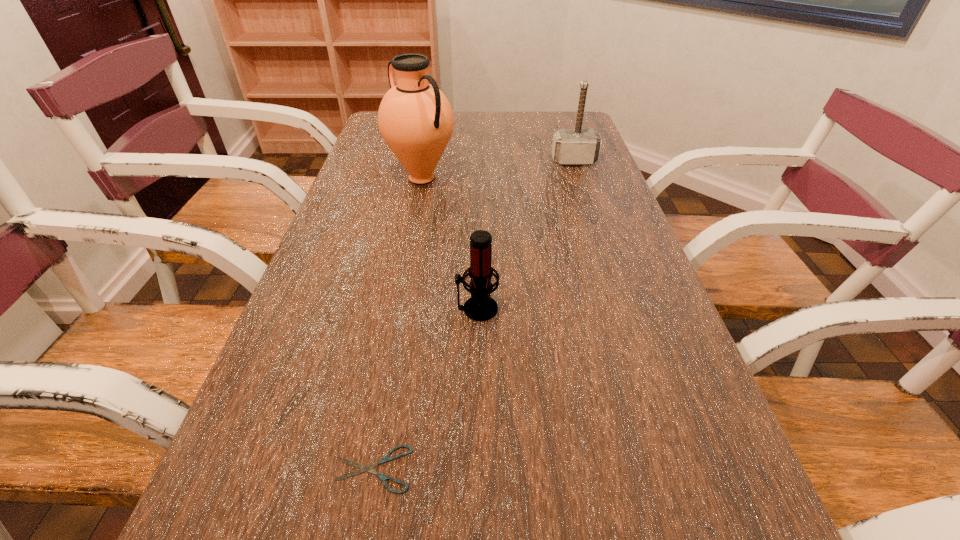
Where is `pitcher`? This screenshot has width=960, height=540. pitcher is located at coordinates (415, 119).

Image resolution: width=960 pixels, height=540 pixels. In order to click on the rightmost object in this screenshot , I will do `click(578, 146)`.

Locate an element on the screen. The image size is (960, 540). the second tallest object is located at coordinates (578, 146).

Locate an element on the screen. The height and width of the screenshot is (540, 960). microphone is located at coordinates (480, 307).

Locate an element on the screen. the second nearest object is located at coordinates (480, 307).

The image size is (960, 540). I want to click on the nearest object, so click(386, 458).

The width and height of the screenshot is (960, 540). I want to click on the shortest object, so click(386, 458).

Identify the location of vacant point located 0.330m on the back of the pitcher. (433, 119).

The image size is (960, 540). In order to click on free spot located 0.380m for striking with the head of the third shortest object in this screenshot , I will do `click(602, 245)`.

Where is `free spot located 0.100m on the right of the third tallest object`? The width and height of the screenshot is (960, 540). free spot located 0.100m on the right of the third tallest object is located at coordinates (547, 308).